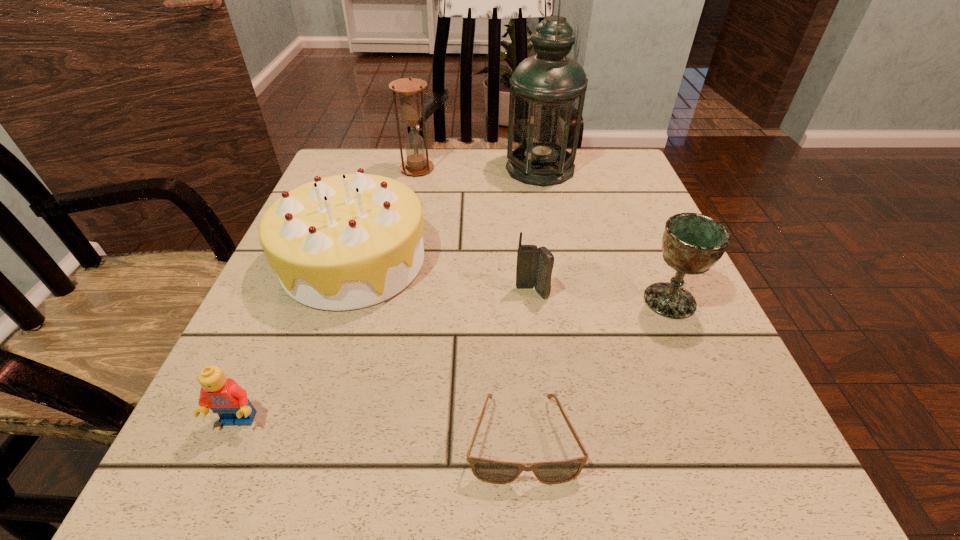
Identify the location of oil lamp. (547, 93).

Where is `hourglass`? hourglass is located at coordinates coord(409,89).

This screenshot has height=540, width=960. Identify the location of birthday cake. (344, 242).

Locate an element on the screen. The image size is (960, 540). the rightmost object is located at coordinates (692, 243).

Find the location of a particular element. The height and width of the screenshot is (540, 960). cellular telephone is located at coordinates coord(534,267).

This screenshot has height=540, width=960. What are the coordinates of `Lego` in the screenshot? It's located at (223, 396).

Where is `the shortest object`? the shortest object is located at coordinates (491, 471).

Identify the location of free spot located 0.270m on the left of the oil lamp. The height and width of the screenshot is (540, 960). (399, 168).

Locate an element on the screen. The width and height of the screenshot is (960, 540). blank space located 0.110m on the right of the hourglass is located at coordinates (477, 169).

The image size is (960, 540). I want to click on free location located 0.270m on the front of the birthday cake, so click(286, 473).